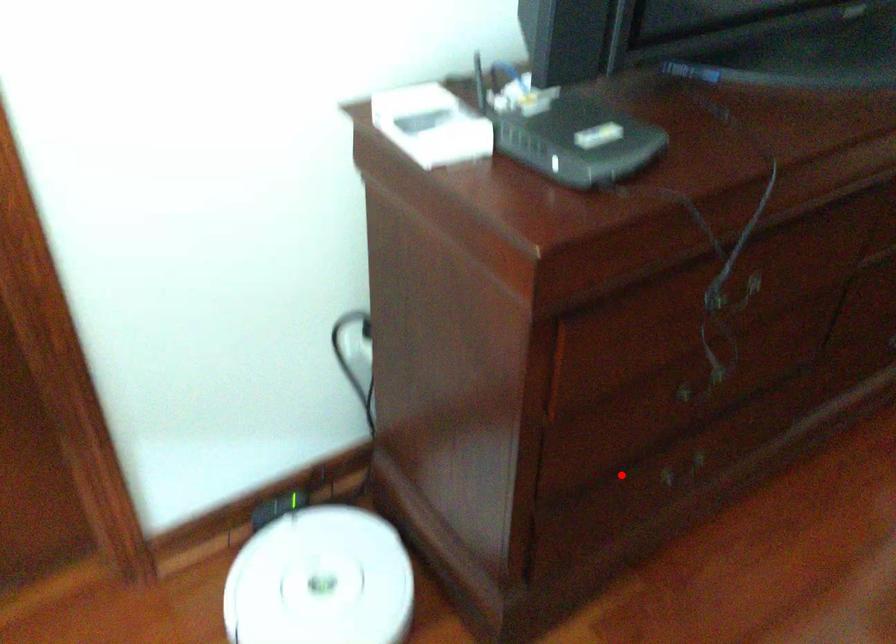
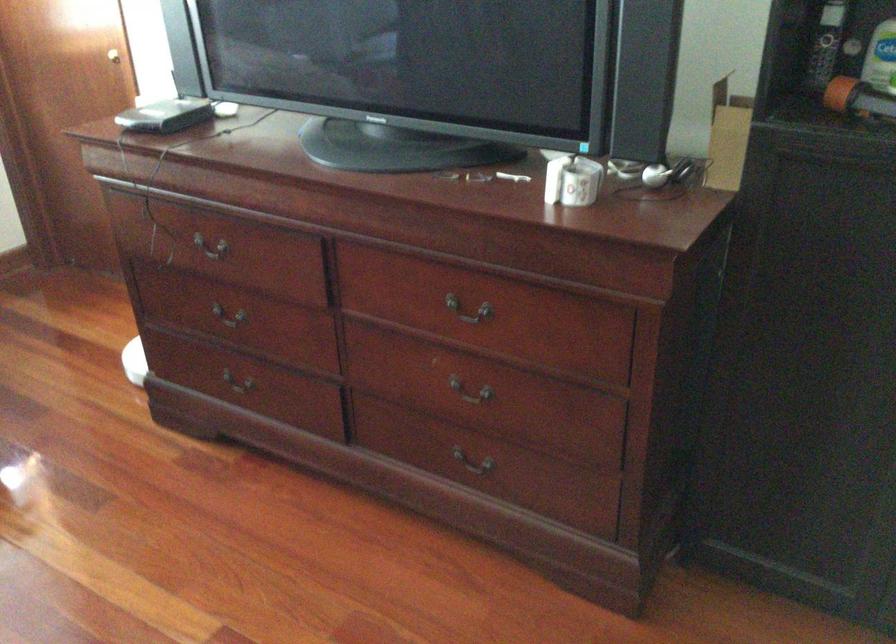
In the second image, find the point that corresponds to the highlighted location in the first image.

(236, 391)